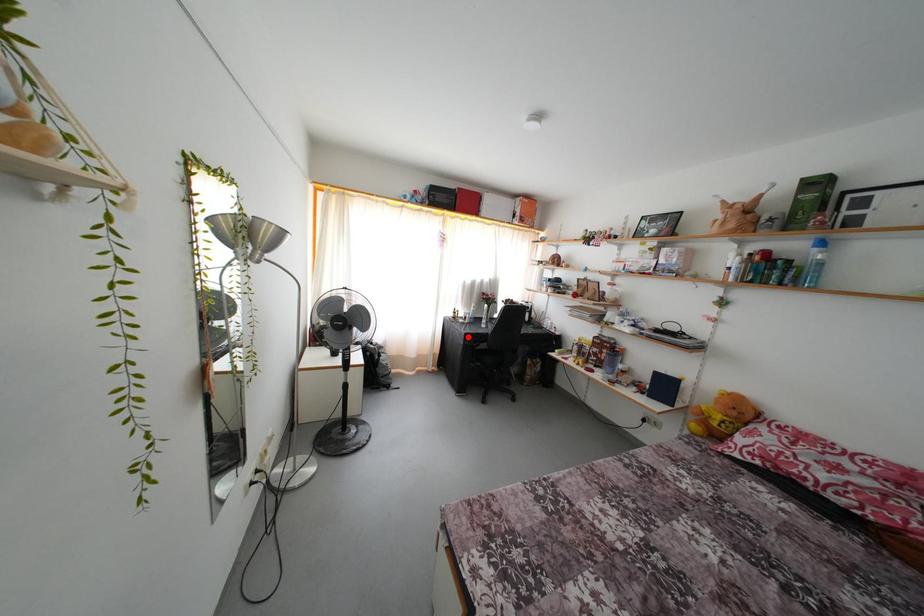
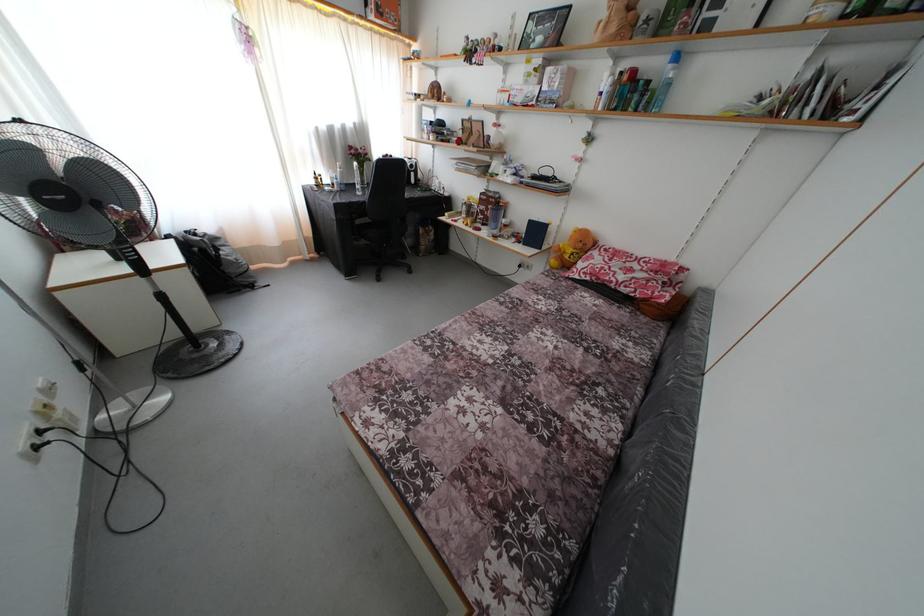
Question: I am providing you with two images of the same scene from different viewpoints. In image1, a red point is highlighted. Considering the same 3D point in image2, which of the following is correct?

Choices:
 (A) It is closer
 (B) It is farther

Answer: (A)